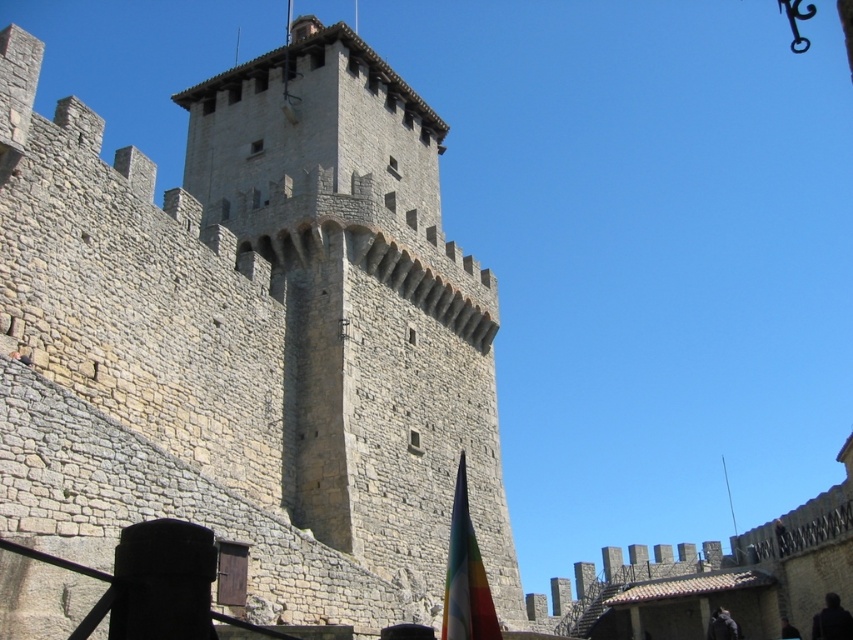
Which is below, stone tower at center or multicolored fabric flag at lower center?

multicolored fabric flag at lower center is below.

Between point (294, 390) and point (444, 611), which one is positioned behind?

The point (294, 390) is more distant.

Locate an element on the screen. Image resolution: width=853 pixels, height=640 pixels. stone tower at center is located at coordinates coord(251,336).